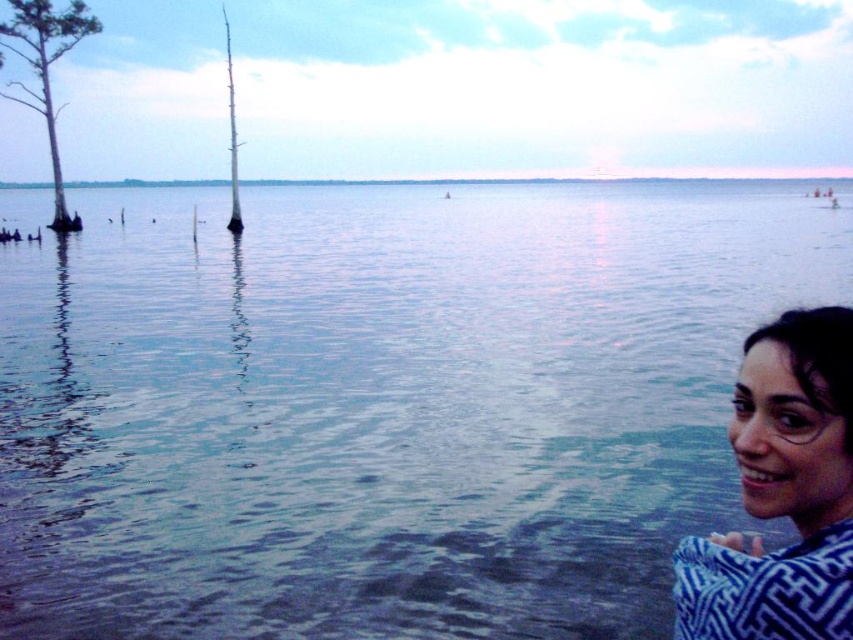
You are a kayaker planning to navigate through the lakeside scene. You see the point at coordinates [384,404]. What is the nature of the water at that location?

The point at coordinates [384,404] corresponds to clear water at center, so the water there is clear and navigable.

You are standing at the edge of the lake and see the clear water at center and the blue woven fabric at lower right. Which object is closer to your left side?

The clear water at center is to the left of the blue woven fabric at lower right, so the clear water at center is closer to your left side.